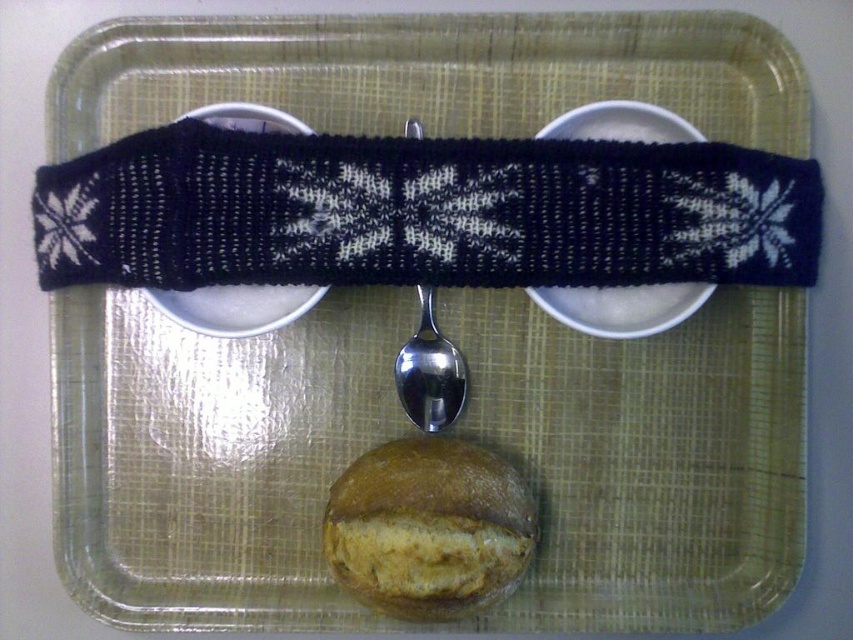
Which is above, black knitted band at upper center or black knitted plate at center?

Positioned higher is black knitted band at upper center.

Measure the distance between point (577, 307) and camera.

A distance of 3.76 feet exists between point (577, 307) and camera.

The image size is (853, 640). I want to click on black knitted band at upper center, so click(x=621, y=307).

At what (x,y) coordinates should I click in order to perform the action: click on black knitted band at upper center. Please return your answer as a coordinate pair (x, y). This screenshot has width=853, height=640. Looking at the image, I should click on (621, 307).

Which of these two, golden brown crusty bread at center or black knitted band at upper center, stands shorter?

golden brown crusty bread at center is shorter.

Is point (401, 445) in front of point (608, 326)?

No.

Identify the location of golden brown crusty bread at center. (428, 528).

Which is behind, point (405, 520) or point (427, 385)?

Point (427, 385)

Is golden brown crusty bread at center positioned in front of satin silver spoon at center?

Yes, it is in front of satin silver spoon at center.

The width and height of the screenshot is (853, 640). What do you see at coordinates (428, 528) in the screenshot?
I see `golden brown crusty bread at center` at bounding box center [428, 528].

The image size is (853, 640). I want to click on golden brown crusty bread at center, so click(x=428, y=528).